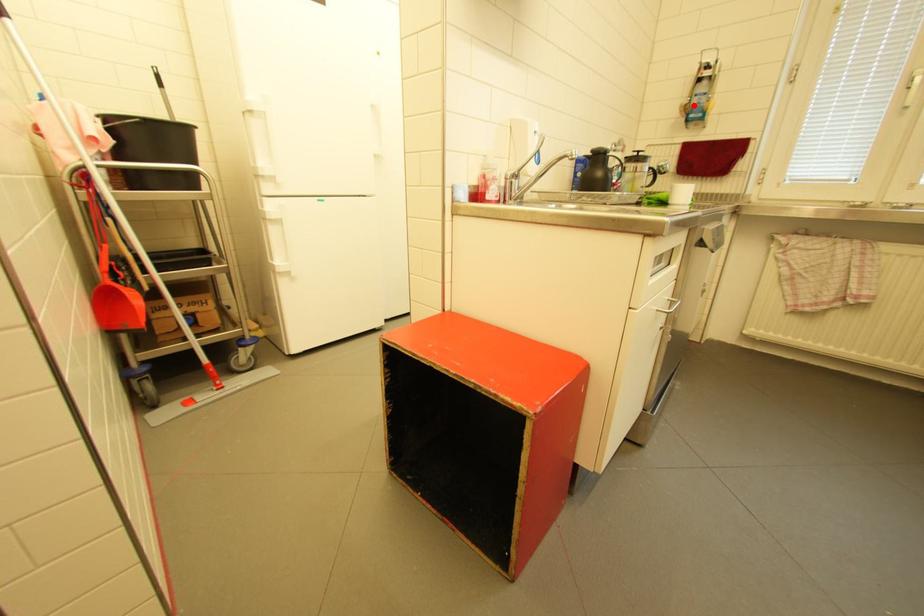
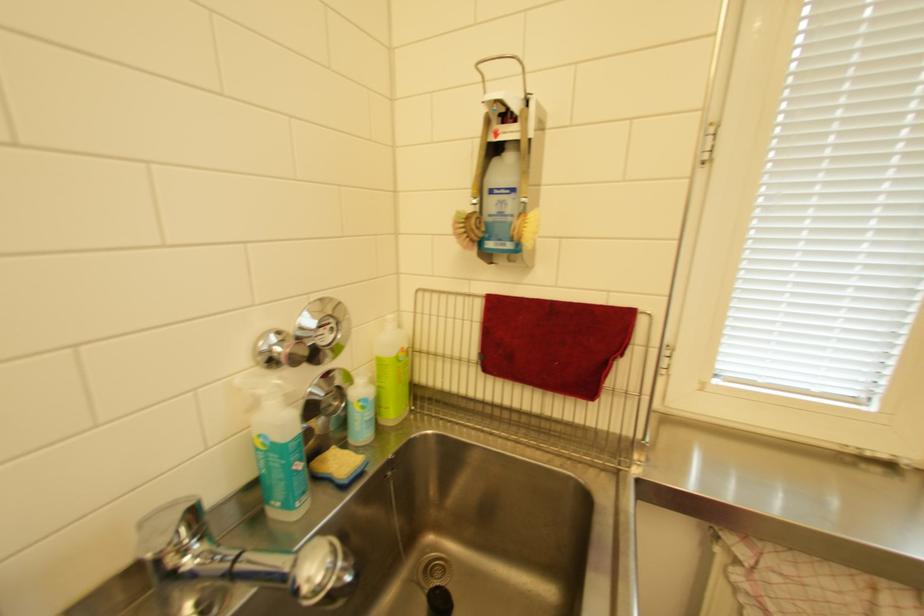
In the second image, find the point that corresponds to the highlighted location in the first image.

(475, 217)